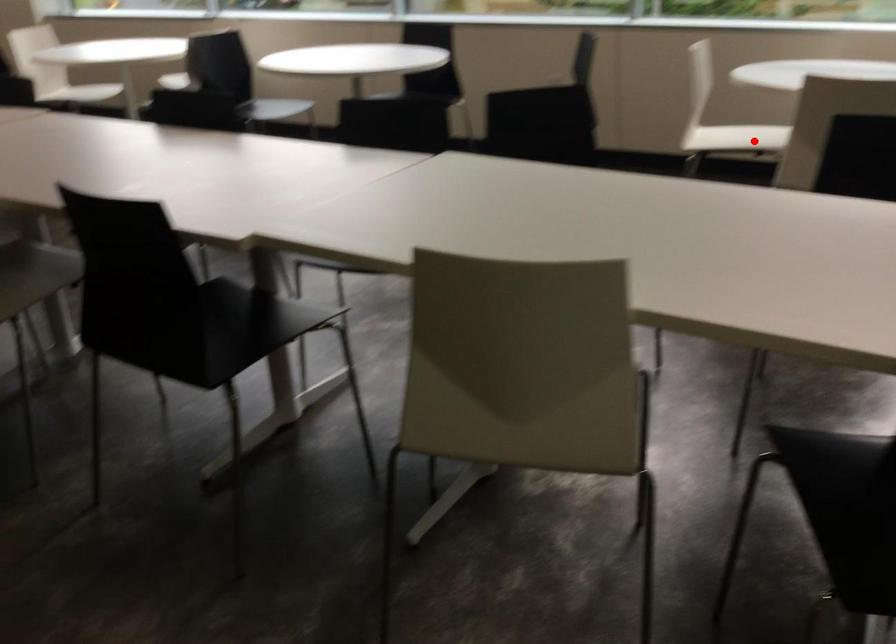
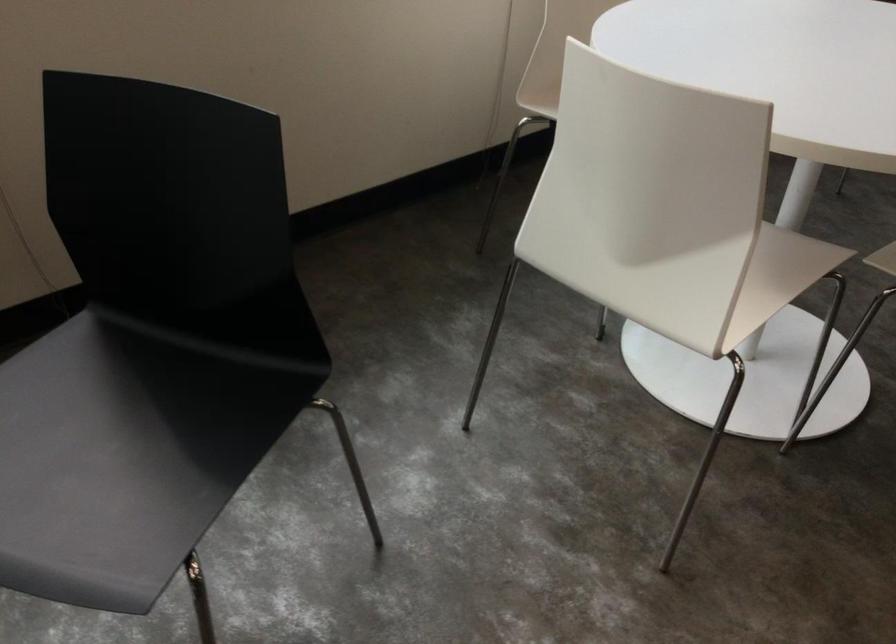
In the second image, find the point that corresponds to the highlighted location in the first image.

(777, 277)